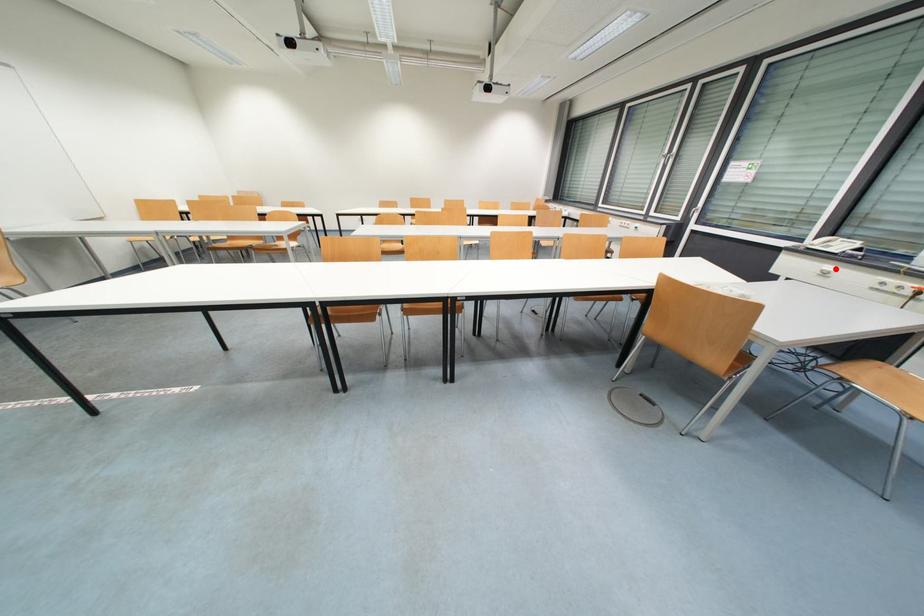
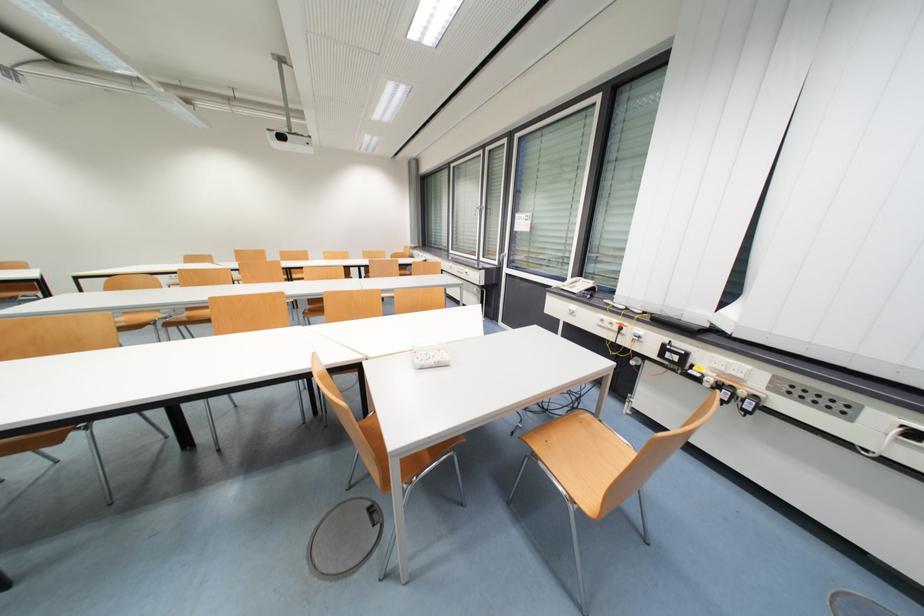
Find the pixel in the second image that matches the highlighted location in the first image.

(578, 309)